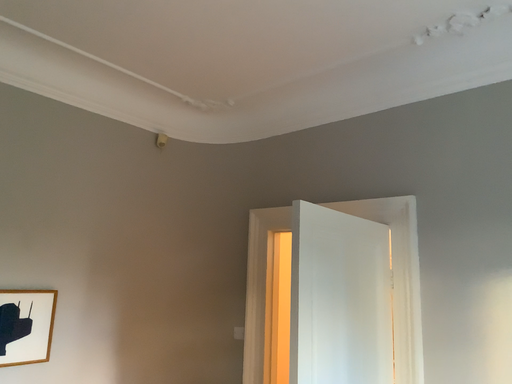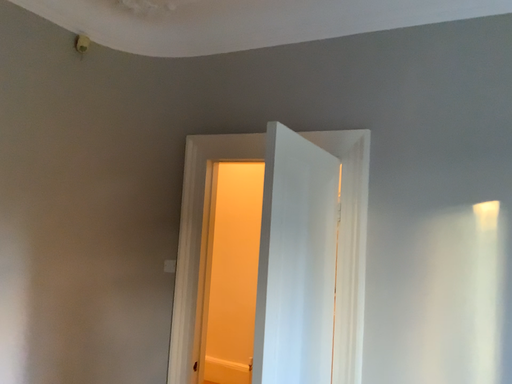
Question: How did the camera likely rotate when shooting the video?

Choices:
 (A) rotated downward
 (B) rotated upward

Answer: (A)